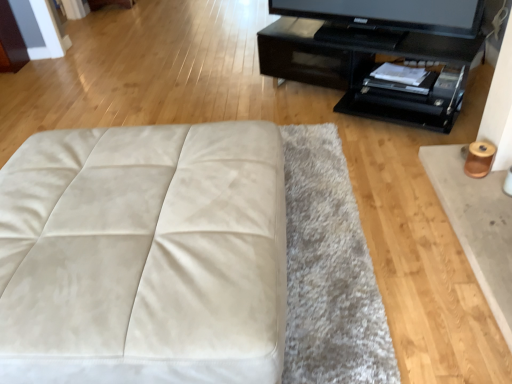
Question: Is black glossy tv stand at upper right surrounded by matte black television at upper right?

Choices:
 (A) no
 (B) yes

Answer: (A)

Question: Is matte black television at upper right smaller than black glossy tv stand at upper right?

Choices:
 (A) yes
 (B) no

Answer: (A)

Question: Can you confirm if matte black television at upper right is shorter than black glossy tv stand at upper right?

Choices:
 (A) yes
 (B) no

Answer: (A)

Question: Does matte black television at upper right appear on the right side of black glossy tv stand at upper right?

Choices:
 (A) no
 (B) yes

Answer: (B)

Question: Does matte black television at upper right lie in front of black glossy tv stand at upper right?

Choices:
 (A) no
 (B) yes

Answer: (A)

Question: Is matte black television at upper right positioned behind black glossy tv stand at upper right?

Choices:
 (A) yes
 (B) no

Answer: (A)

Question: Is black glossy tv stand at upper right wider than white suede ottoman at center?

Choices:
 (A) no
 (B) yes

Answer: (A)

Question: Does black glossy tv stand at upper right appear on the right side of white suede ottoman at center?

Choices:
 (A) yes
 (B) no

Answer: (A)

Question: Does black glossy tv stand at upper right lie in front of white suede ottoman at center?

Choices:
 (A) no
 (B) yes

Answer: (A)

Question: Does black glossy tv stand at upper right turn towards white suede ottoman at center?

Choices:
 (A) no
 (B) yes

Answer: (B)

Question: From the image's perspective, is black glossy tv stand at upper right below white suede ottoman at center?

Choices:
 (A) no
 (B) yes

Answer: (A)

Question: From a real-world perspective, is black glossy tv stand at upper right under white suede ottoman at center?

Choices:
 (A) no
 (B) yes

Answer: (B)

Question: From the image's perspective, is black glossy tv stand at upper right located above matte black television at upper right?

Choices:
 (A) yes
 (B) no

Answer: (B)